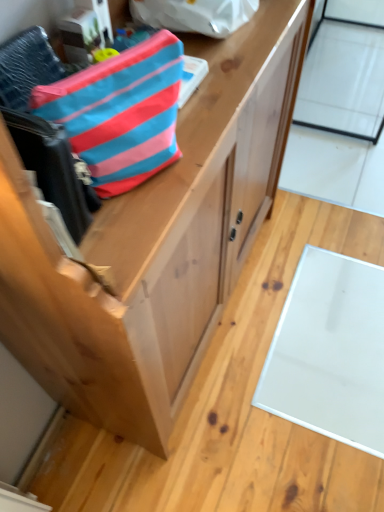
What do you see at coordinates (154, 242) in the screenshot?
I see `natural wood cabinet at center` at bounding box center [154, 242].

Measure the distance between blue striped fabric pouch at upper center, placed as the first pouch when sorted from back to front, and camera.

The distance of blue striped fabric pouch at upper center, placed as the first pouch when sorted from back to front, from camera is 29.14 inches.

What is the approximate width of transparent glass door at upper right?

transparent glass door at upper right is 18.18 inches wide.

How much space does blue striped fabric pouch at upper left, the 2th pouch in the top-to-bottom sequence, occupy vertically?

6.73 inches.

The width and height of the screenshot is (384, 512). I want to click on natural wood cabinet at center, so click(154, 242).

Is natural wood cabinet at center bigger or smaller than blue striped fabric pouch at upper center, placed as the first pouch when sorted from back to front?

Considering their sizes, natural wood cabinet at center takes up more space than blue striped fabric pouch at upper center, placed as the first pouch when sorted from back to front.

Consider the image. How many degrees apart are the facing directions of natural wood cabinet at center and blue striped fabric pouch at upper center, the 2th pouch positioned from the bottom?

natural wood cabinet at center and blue striped fabric pouch at upper center, the 2th pouch positioned from the bottom, are facing 1.08 degrees away from each other.

From a real-world perspective, is natural wood cabinet at center located higher than blue striped fabric pouch at upper center, the 2th pouch positioned from the bottom?

No, from a real-world perspective, natural wood cabinet at center is not over blue striped fabric pouch at upper center, the 2th pouch positioned from the bottom

Does natural wood cabinet at center have a greater height compared to blue striped fabric pouch at upper center, the 1th pouch viewed from the top?

Indeed, natural wood cabinet at center has a greater height compared to blue striped fabric pouch at upper center, the 1th pouch viewed from the top.

Based on the photo, does blue striped fabric pouch at upper left, marked as the 1th pouch in a front-to-back arrangement, have a greater width compared to transparent glass door at upper right?

No.

Is transparent glass door at upper right surrounded by blue striped fabric pouch at upper left, which is the first pouch from bottom to top?

No, transparent glass door at upper right is not surrounded by blue striped fabric pouch at upper left, which is the first pouch from bottom to top.

Is blue striped fabric pouch at upper center, the 2th pouch when ordered from front to back, not near natural wood cabinet at center?

blue striped fabric pouch at upper center, the 2th pouch when ordered from front to back, is near natural wood cabinet at center, not far away.

Does blue striped fabric pouch at upper center, the 2th pouch positioned from the bottom, have a larger size compared to natural wood cabinet at center?

Incorrect, blue striped fabric pouch at upper center, the 2th pouch positioned from the bottom, is not larger than natural wood cabinet at center.

From the image's perspective, is blue striped fabric pouch at upper center, the 2th pouch when ordered from front to back, below natural wood cabinet at center?

No, from the image's perspective, blue striped fabric pouch at upper center, the 2th pouch when ordered from front to back, is not beneath natural wood cabinet at center.

From the image's perspective, between blue striped fabric pouch at upper left, which is the first pouch from bottom to top, and natural wood cabinet at center, which one is located above?

blue striped fabric pouch at upper left, which is the first pouch from bottom to top.

Consider the image. Could natural wood cabinet at center be considered to be inside blue striped fabric pouch at upper left, marked as the 1th pouch in a front-to-back arrangement?

Actually, natural wood cabinet at center is outside blue striped fabric pouch at upper left, marked as the 1th pouch in a front-to-back arrangement.

Does blue striped fabric pouch at upper left, marked as the 1th pouch in a front-to-back arrangement, come behind natural wood cabinet at center?

No, blue striped fabric pouch at upper left, marked as the 1th pouch in a front-to-back arrangement, is closer to the camera.

Which of these two, blue striped fabric pouch at upper left, positioned as the second pouch in back-to-front order, or natural wood cabinet at center, is smaller?

blue striped fabric pouch at upper left, positioned as the second pouch in back-to-front order, is smaller.

Find the location of a particular element. This screenshot has width=384, height=512. pouch on the left of blue striped fabric pouch at upper center, the 1th pouch viewed from the top is located at coordinates (121, 112).

Between blue striped fabric pouch at upper center, the 2th pouch when ordered from front to back, and blue striped fabric pouch at upper left, marked as the 1th pouch in a front-to-back arrangement, which one has less height?

Standing shorter between the two is blue striped fabric pouch at upper center, the 2th pouch when ordered from front to back.

Can you confirm if blue striped fabric pouch at upper center, the 2th pouch when ordered from front to back, is smaller than blue striped fabric pouch at upper left, positioned as the second pouch in back-to-front order?

Indeed, blue striped fabric pouch at upper center, the 2th pouch when ordered from front to back, has a smaller size compared to blue striped fabric pouch at upper left, positioned as the second pouch in back-to-front order.

Between blue striped fabric pouch at upper center, the 2th pouch when ordered from front to back, and blue striped fabric pouch at upper left, positioned as the second pouch in back-to-front order, which one has smaller width?

blue striped fabric pouch at upper left, positioned as the second pouch in back-to-front order, is thinner.

Which of these two, blue striped fabric pouch at upper left, the 2th pouch in the top-to-bottom sequence, or blue striped fabric pouch at upper center, the 2th pouch positioned from the bottom, stands shorter?

blue striped fabric pouch at upper center, the 2th pouch positioned from the bottom.

Which of these two, blue striped fabric pouch at upper left, marked as the 1th pouch in a front-to-back arrangement, or blue striped fabric pouch at upper center, the 2th pouch positioned from the bottom, is smaller?

With smaller size is blue striped fabric pouch at upper center, the 2th pouch positioned from the bottom.

From the image's perspective, is blue striped fabric pouch at upper left, the 2th pouch in the top-to-bottom sequence, positioned above or below blue striped fabric pouch at upper center, placed as the first pouch when sorted from back to front?

Based on their image positions, blue striped fabric pouch at upper left, the 2th pouch in the top-to-bottom sequence, is located beneath blue striped fabric pouch at upper center, placed as the first pouch when sorted from back to front.

How many degrees apart are the facing directions of transparent glass door at upper right and blue striped fabric pouch at upper left, the 2th pouch in the top-to-bottom sequence?

transparent glass door at upper right and blue striped fabric pouch at upper left, the 2th pouch in the top-to-bottom sequence, are facing 29.4 degrees away from each other.

Does transparent glass door at upper right contain blue striped fabric pouch at upper left, positioned as the second pouch in back-to-front order?

Actually, blue striped fabric pouch at upper left, positioned as the second pouch in back-to-front order, is outside transparent glass door at upper right.

Relative to blue striped fabric pouch at upper left, marked as the 1th pouch in a front-to-back arrangement, is transparent glass door at upper right in front or behind?

In the image, transparent glass door at upper right appears behind blue striped fabric pouch at upper left, marked as the 1th pouch in a front-to-back arrangement.

How much distance is there between transparent glass door at upper right and blue striped fabric pouch at upper left, marked as the 1th pouch in a front-to-back arrangement?

A distance of 1.79 meters exists between transparent glass door at upper right and blue striped fabric pouch at upper left, marked as the 1th pouch in a front-to-back arrangement.

The width and height of the screenshot is (384, 512). What are the coordinates of `the 1st pouch in front of the natural wood cabinet at center, starting your count from the anchor` in the screenshot? It's located at (195, 15).

You are a GUI agent. You are given a task and a screenshot of the screen. Output one action in this format:
    pyautogui.click(x=<x>, y=<y>)
    Task: Click on the glass door that appears behind the blue striped fabric pouch at upper left, which is the first pouch from bottom to top
    This screenshot has height=512, width=384.
    Given the screenshot: What is the action you would take?
    pyautogui.click(x=345, y=71)

Looking at the image, which one is located further to natural wood cabinet at center, blue striped fabric pouch at upper center, placed as the first pouch when sorted from back to front, or transparent glass door at upper right?

Based on the image, transparent glass door at upper right appears to be further to natural wood cabinet at center.

Estimate the real-world distances between objects in this image. Which object is closer to blue striped fabric pouch at upper left, positioned as the second pouch in back-to-front order, natural wood cabinet at center or blue striped fabric pouch at upper center, the 1th pouch viewed from the top?

natural wood cabinet at center lies closer to blue striped fabric pouch at upper left, positioned as the second pouch in back-to-front order, than the other object.

Which object lies further to the anchor point natural wood cabinet at center, blue striped fabric pouch at upper center, the 2th pouch positioned from the bottom, or blue striped fabric pouch at upper left, positioned as the second pouch in back-to-front order?

blue striped fabric pouch at upper center, the 2th pouch positioned from the bottom, lies further to natural wood cabinet at center than the other object.

Considering their positions, is blue striped fabric pouch at upper left, marked as the 1th pouch in a front-to-back arrangement, positioned closer to transparent glass door at upper right than blue striped fabric pouch at upper center, the 2th pouch positioned from the bottom?

blue striped fabric pouch at upper center, the 2th pouch positioned from the bottom.

When comparing their distances from natural wood cabinet at center, does transparent glass door at upper right or blue striped fabric pouch at upper center, the 2th pouch when ordered from front to back, seem further?

The object further to natural wood cabinet at center is transparent glass door at upper right.

When comparing their distances from blue striped fabric pouch at upper center, the 2th pouch positioned from the bottom, does transparent glass door at upper right or natural wood cabinet at center seem closer?

Among the two, natural wood cabinet at center is located nearer to blue striped fabric pouch at upper center, the 2th pouch positioned from the bottom.

Based on their spatial positions, is transparent glass door at upper right or blue striped fabric pouch at upper left, marked as the 1th pouch in a front-to-back arrangement, closer to natural wood cabinet at center?

blue striped fabric pouch at upper left, marked as the 1th pouch in a front-to-back arrangement, is closer to natural wood cabinet at center.

Looking at the image, which one is located further to transparent glass door at upper right, blue striped fabric pouch at upper center, the 1th pouch viewed from the top, or blue striped fabric pouch at upper left, marked as the 1th pouch in a front-to-back arrangement?

The object further to transparent glass door at upper right is blue striped fabric pouch at upper left, marked as the 1th pouch in a front-to-back arrangement.

This screenshot has height=512, width=384. Identify the location of pouch between blue striped fabric pouch at upper left, the 2th pouch in the top-to-bottom sequence, and transparent glass door at upper right, along the z-axis. (195, 15).

Identify the location of pouch between blue striped fabric pouch at upper center, placed as the first pouch when sorted from back to front, and natural wood cabinet at center from top to bottom. (121, 112).